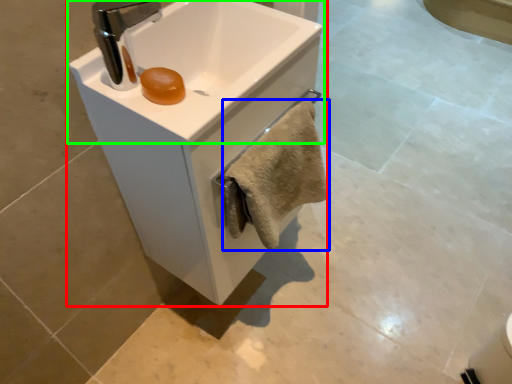
Question: Which object is positioned closest to sink (highlighted by a red box)? Select from bath towel (highlighted by a blue box) and sink (highlighted by a green box).

Choices:
 (A) bath towel
 (B) sink

Answer: (B)